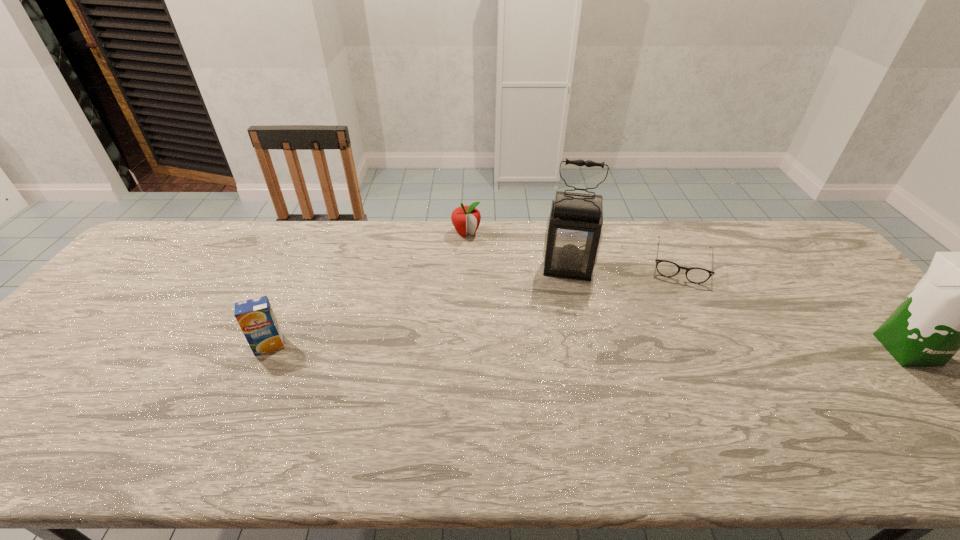
Identify the location of vacant space in between the tallest object and the apple. This screenshot has width=960, height=540. (517, 251).

I want to click on empty space that is in between the third object from right to left and the third shortest object, so click(x=419, y=307).

At what (x,y) coordinates should I click in order to perform the action: click on free space between the third object from left to right and the third shortest object. Please return your answer as a coordinate pair (x, y). Looking at the image, I should click on (419, 307).

The width and height of the screenshot is (960, 540). I want to click on vacant region between the lantern and the shortest object, so click(x=624, y=266).

Image resolution: width=960 pixels, height=540 pixels. What are the coordinates of `free spot between the rightmost object and the orange_juice` in the screenshot? It's located at (588, 348).

In order to click on free space between the spectacles and the second tallest object in this screenshot , I will do `click(794, 306)`.

This screenshot has width=960, height=540. I want to click on blank region between the lantern and the leftmost object, so click(x=419, y=307).

Identify the location of free space that is in between the spectacles and the third shortest object. Image resolution: width=960 pixels, height=540 pixels. (475, 304).

This screenshot has width=960, height=540. Identify the location of unoccupied area between the fourth tallest object and the lantern. (517, 251).

You are a GUI agent. You are given a task and a screenshot of the screen. Output one action in this format:
    pyautogui.click(x=<x>, y=<y>)
    Task: Click on the object that is the fourth nearest to the shortest object
    This screenshot has height=540, width=960.
    Given the screenshot: What is the action you would take?
    pyautogui.click(x=256, y=318)